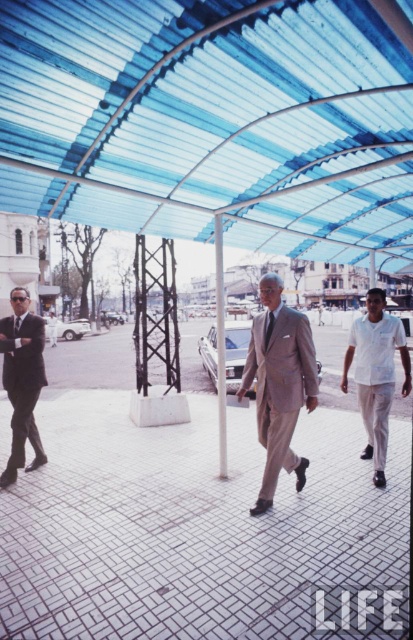
You are standing under the curved blue roof and want to walk towards the two points marked in the scene. Which point, point (x=384, y=618) or point (x=266, y=440), will you reach first?

Point (x=384, y=618) is closer to the viewer than point (x=266, y=440), so you will reach point (x=384, y=618) first.

From the picture: You are standing at the camera position and want to step onto the white tile pavement at center. Is the distance within a comfortable reach for an average person?

The white tile pavement at center is 2.99 meters away from camera, so the distance is within a comfortable reach for an average person as it is just under 3 meters.